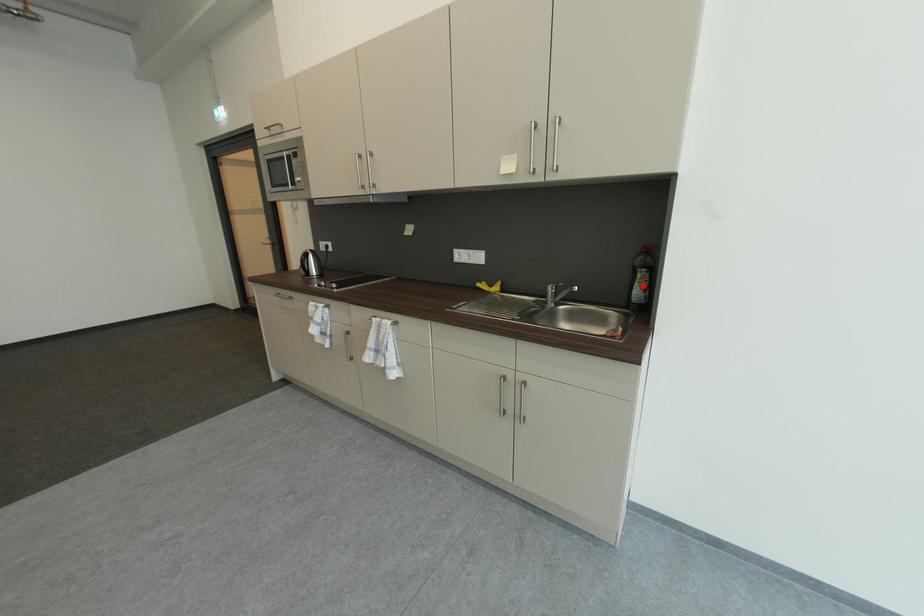
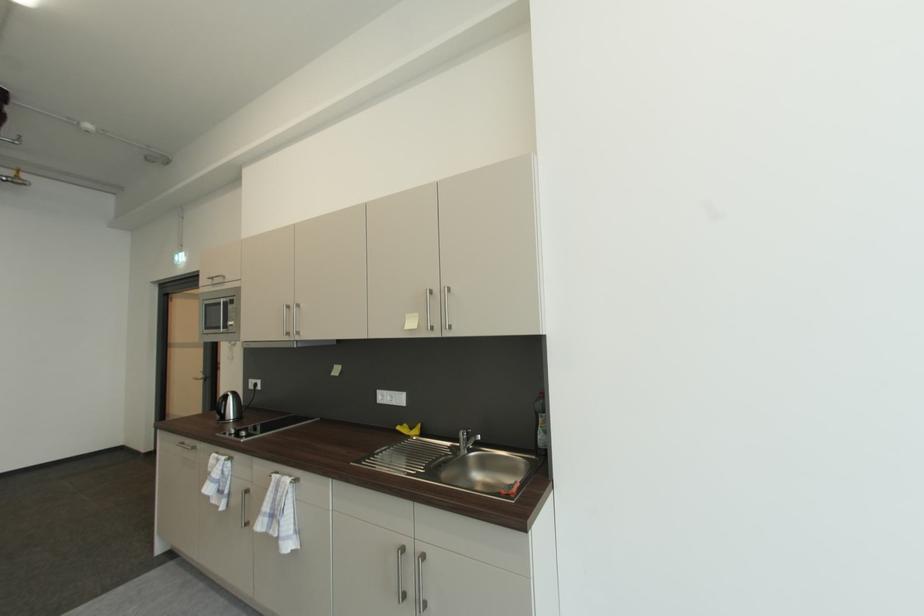
Question: I am providing you with two images of the same scene from different viewpoints. A red point is shown in image1. For the corresponding object point in image2, is it positioned nearer or farther from the camera?

Choices:
 (A) Nearer
 (B) Farther

Answer: (B)